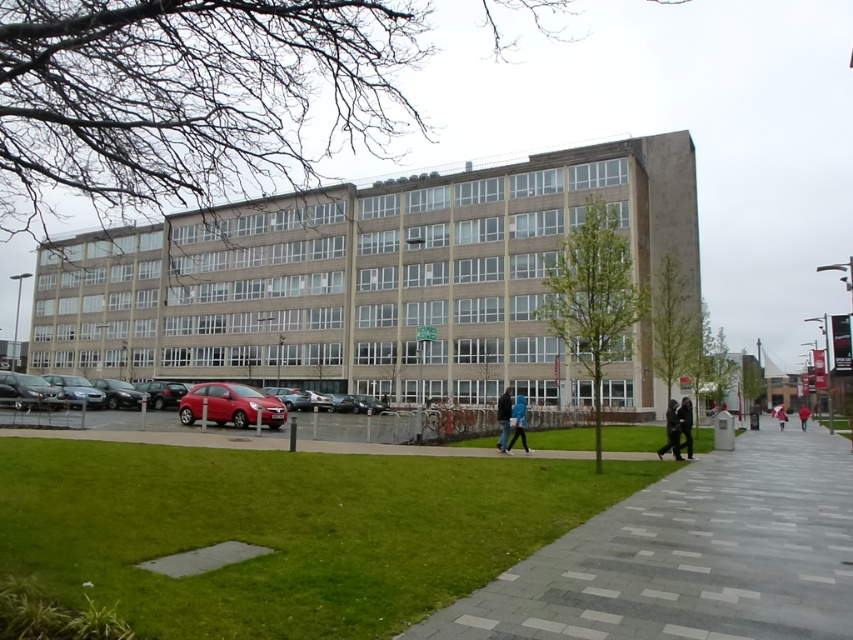
You are standing on the sidewalk in front of the building and see the shiny silver sedan at lower left and the red jacket at center. Which object is nearer to you?

The shiny silver sedan at lower left is closer to the viewer than the red jacket at center.

You are a delivery person needing to park your vehicle next to the shiny silver sedan at lower left. The parking space must be wide enough to accommodate both your vehicle and the red jacket at center. Is there enough space between them?

The shiny silver sedan at lower left is thinner than the red jacket at center. Since the sedan is thinner, there might be sufficient space next to it for your vehicle, but the presence of the red jacket at center could obstruct the parking space. Please check the actual dimensions before proceeding.

You are a delivery person trying to park your vehicle in the parking spot between the glossy red hatchback at lower left and the dark gray fabric jacket at lower right. Based on the space they occupy, can you fit your standard size delivery van there?

The glossy red hatchback at lower left occupies less space than the dark gray fabric jacket at lower right. Since the dark gray fabric jacket at lower right takes up more space, the parking spot between them may not be large enough for a standard size delivery van.